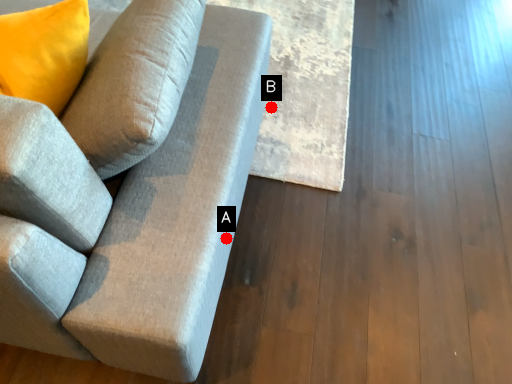
Question: Two points are circled on the image, labeled by A and B beside each circle. Among these points, which one is farthest from the camera?

Choices:
 (A) A is further
 (B) B is further

Answer: (B)